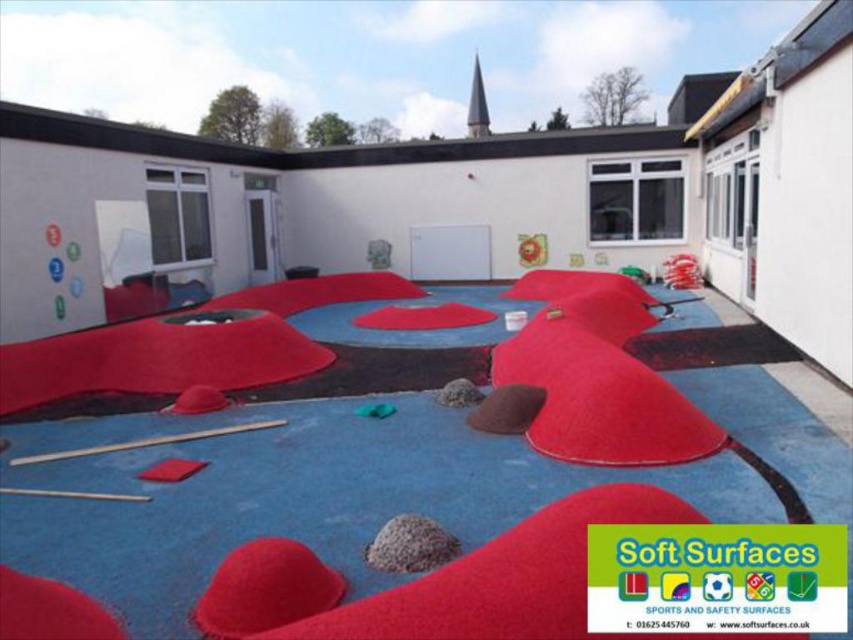
You are a child playing in the outdoor play area and want to kick the green rubber ball at center towards the door. Since the velvet red carpet at center is in the way, will you have to move it to the right or left to clear a path?

The velvet red carpet at center is positioned on the left side of green rubber ball at center. To clear a path towards the door, you would need to move the velvet red carpet at center to the right side of the green rubber ball at center.

You are a child in the play area and you want to pick up the green rubber ball at center. Is the red rubberized mat at center blocking your path to the ball?

The green rubber ball at center is behind the red rubberized mat at center, so the mat is blocking your path to the ball.

You are standing at the entrance of the play area and want to place a new toy exactly at the center of the velvet red carpet at center. According to the coordinates provided, where should you place the toy?

The velvet red carpet at center is located at coordinates point (155, 358), so you should place the toy at that exact point to ensure it is centered.